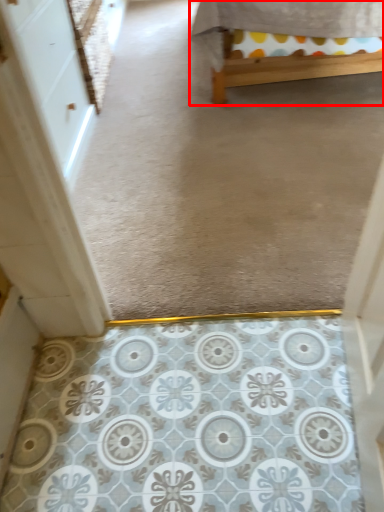
Question: From the image's perspective, where is furniture (annotated by the red box) located in relation to screen door in the image?

Choices:
 (A) above
 (B) below

Answer: (A)